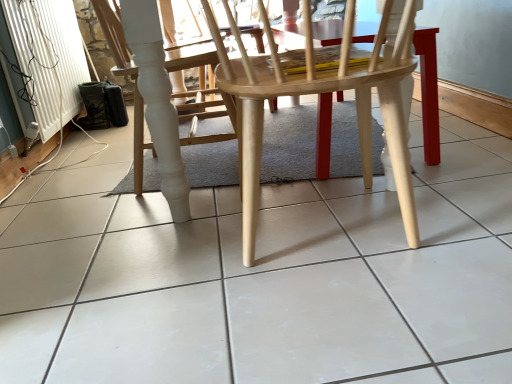
This screenshot has width=512, height=384. In order to click on free space on the front side of white glossy chair at center, the first chair viewed from the back in this screenshot , I will do `click(142, 222)`.